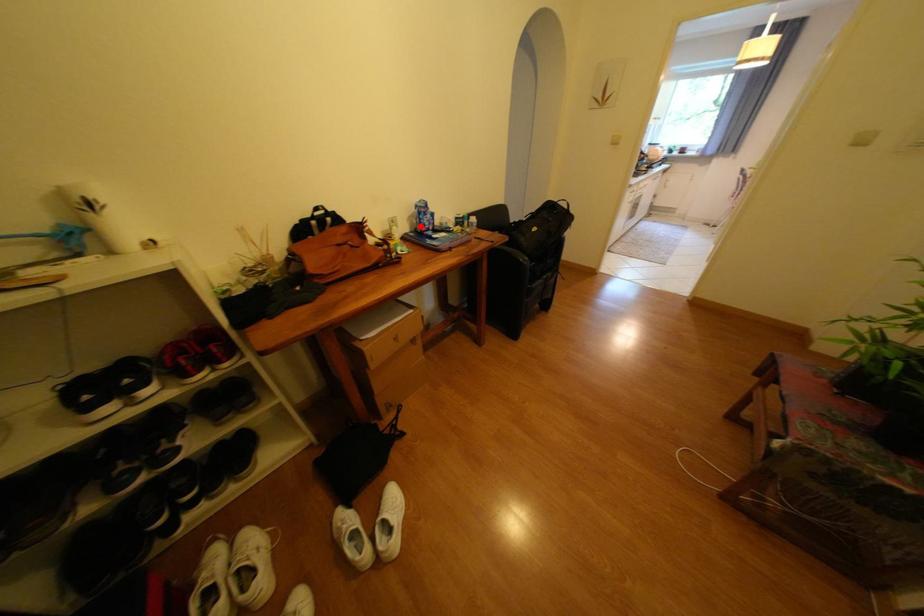
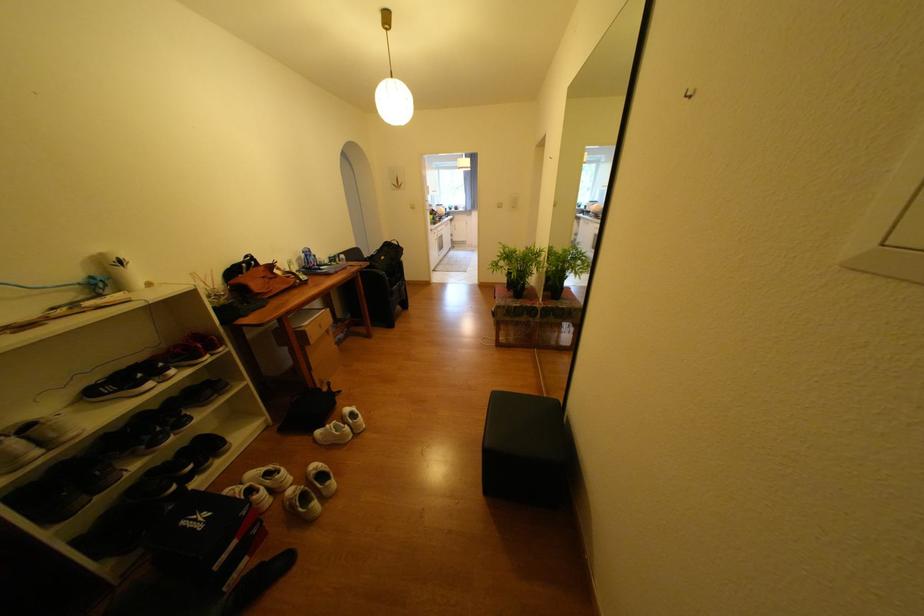
Locate, in the second image, the point that corresponds to the highlighted location in the first image.

(309, 265)